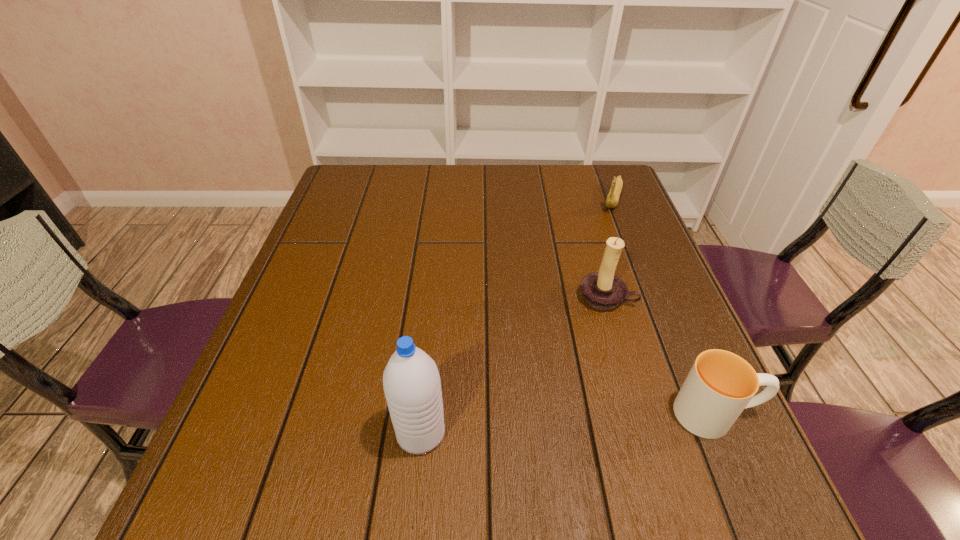
Where is `vacant spot on the desktop that is between the water bottle and the cup and is positioned at the stem of the banana`? The image size is (960, 540). vacant spot on the desktop that is between the water bottle and the cup and is positioned at the stem of the banana is located at coordinates (533, 426).

This screenshot has height=540, width=960. I want to click on vacant spot on the desktop that is between the leftmost object and the cup and is positioned on the wick of the third shortest object, so click(563, 423).